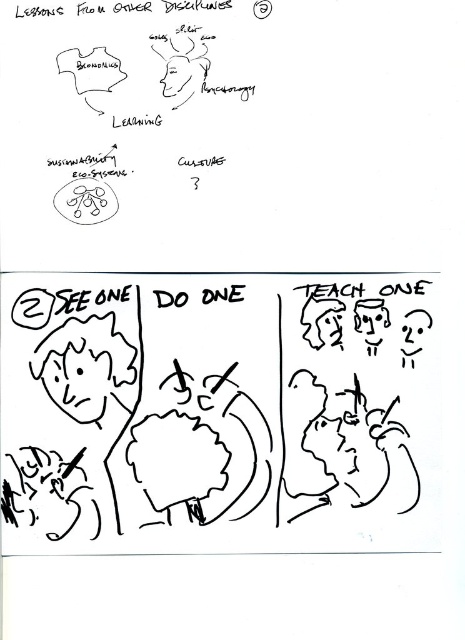
Question: Is black ink pen at lower left closer to the viewer compared to smooth skin face at center?

Choices:
 (A) no
 (B) yes

Answer: (B)

Question: Which point appears closest to the camera in this image?

Choices:
 (A) (1, 500)
 (B) (298, 420)

Answer: (A)

Question: Among these objects, which one is nearest to the camera?

Choices:
 (A) smooth skin face at center
 (B) black ink pen at lower left

Answer: (B)

Question: Is the position of black ink pen at lower left less distant than that of smooth skin face at center?

Choices:
 (A) yes
 (B) no

Answer: (A)

Question: Is black ink pen at lower left wider than smooth skin face at center?

Choices:
 (A) no
 (B) yes

Answer: (B)